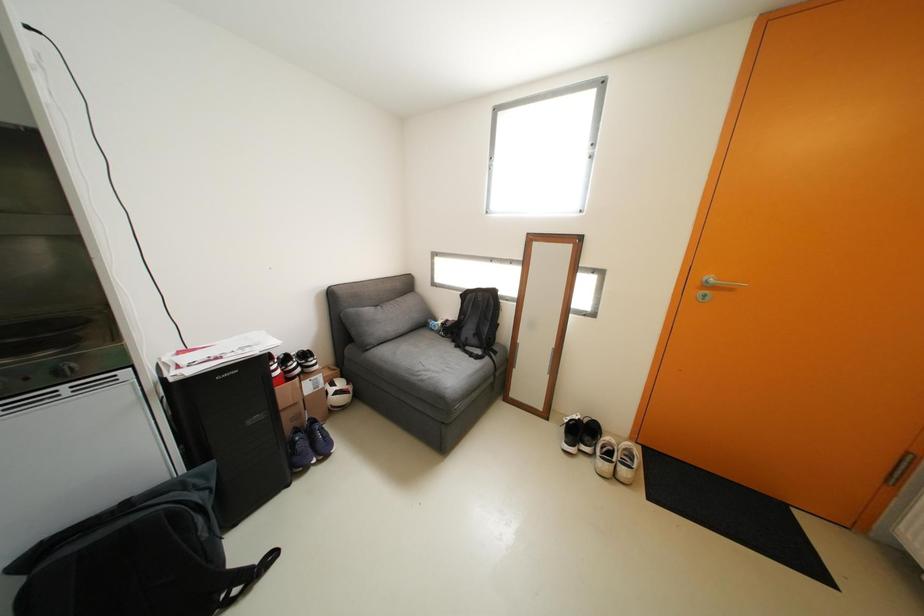
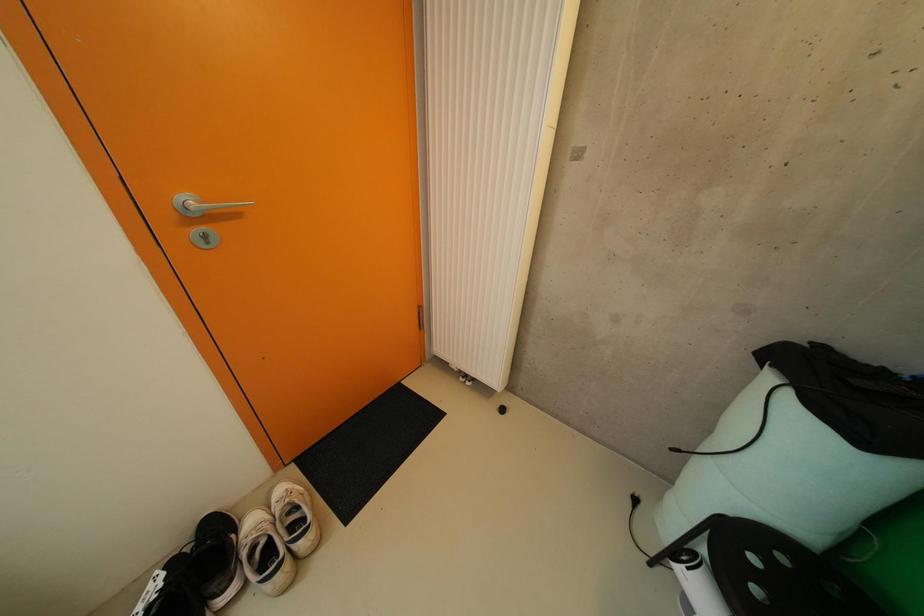
How did the camera likely rotate?

The rotation direction of the camera is right-down.